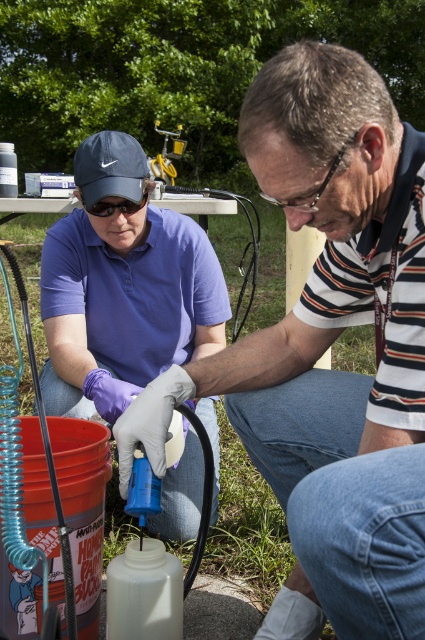
You are standing at the same position as the man in the striped polo shirt. You need to reach both the point at coordinates point (235, 384) and point (292, 147). Which point will you need to reach first without moving your feet?

You will need to reach the point at coordinates point (292, 147) first because it is closer to you than point (235, 384), which is further away.

Looking at this image, you are a safety inspector observing the scene. You notice the purple fabric shirt at center and the clear plastic goggles at center. Which item is closer to your viewpoint?

The purple fabric shirt at center is closer to the viewer than the clear plastic goggles at center.

You are a safety inspector observing the scene. The white matte glove at lower left and the matte black goggles at upper left are both safety equipment. Which one is taller in the image?

The white matte glove at lower left is much taller than the matte black goggles at upper left.